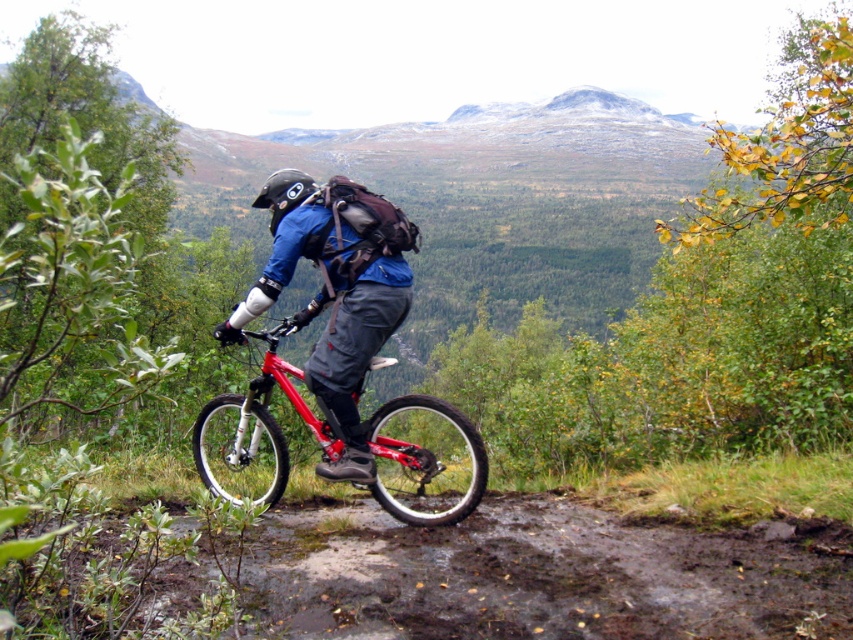
Is the position of brown muddy dirt track at lower center less distant than that of black matte helmet at center?

Yes, brown muddy dirt track at lower center is closer to the viewer.

Between brown muddy dirt track at lower center and black matte helmet at center, which one has less height?

brown muddy dirt track at lower center is shorter.

Between point (822, 547) and point (276, 170), which one is positioned in front?

Point (822, 547) is more forward.

I want to click on brown muddy dirt track at lower center, so click(x=538, y=576).

In the scene shown: Can you confirm if matte blue jacket at center is smaller than black matte helmet at center?

Yes.

Is matte blue jacket at center below black matte helmet at center?

Yes.

Who is more forward, (312,182) or (277,196)?

Point (277,196) is more forward.

Image resolution: width=853 pixels, height=640 pixels. I want to click on matte blue jacket at center, so click(x=335, y=292).

Is brown muddy dirt track at lower center shorter than matte blue jacket at center?

Correct, brown muddy dirt track at lower center is not as tall as matte blue jacket at center.

Between brown muddy dirt track at lower center and matte blue jacket at center, which one has more height?

Standing taller between the two is matte blue jacket at center.

The image size is (853, 640). Find the location of `brown muddy dirt track at lower center`. brown muddy dirt track at lower center is located at coordinates (538, 576).

Where is `brown muddy dirt track at lower center`? This screenshot has height=640, width=853. brown muddy dirt track at lower center is located at coordinates coord(538,576).